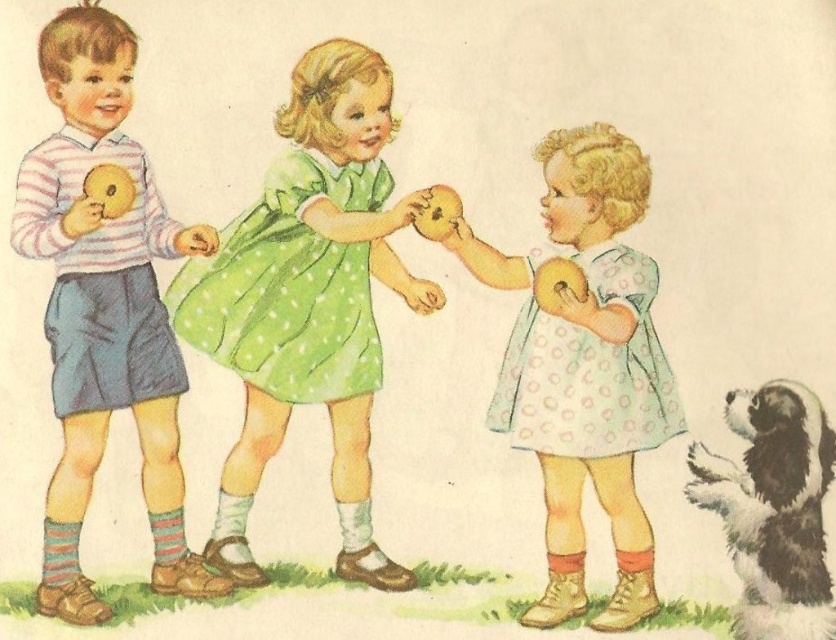
In the scene, there is a girl wearing a green polka dot dress at center and holding a matte yellow plush toy at center. Which object is taller?

The green polka dot dress at center is taller than the matte yellow plush toy at center.

You are standing in the scene and want to place a small flag at the point that is closer to you. Which point should you choose between point (609,420) and point (422,221)?

You should choose point (609,420) because it is closer to you than point (422,221) according to the description.